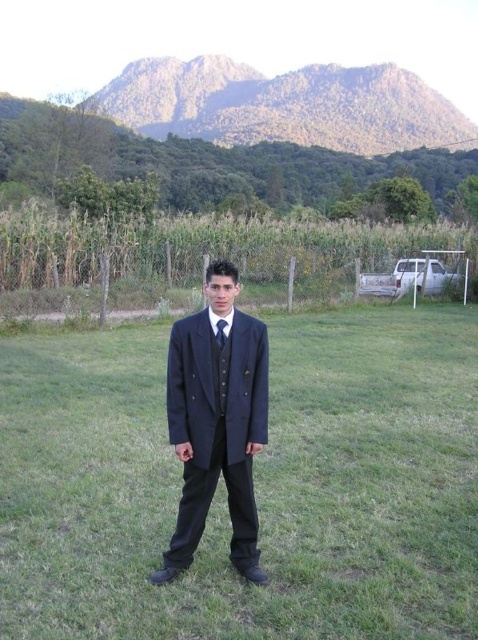
You are a photographer setting up a shot of the young man in the scene. You need to place a small reflector at the point marked by the coordinate point (254, 484). What object should you place the reflector near?

The point (254, 484) marks the navy fabric suit at center, so you should place the reflector near the navy fabric suit at center.